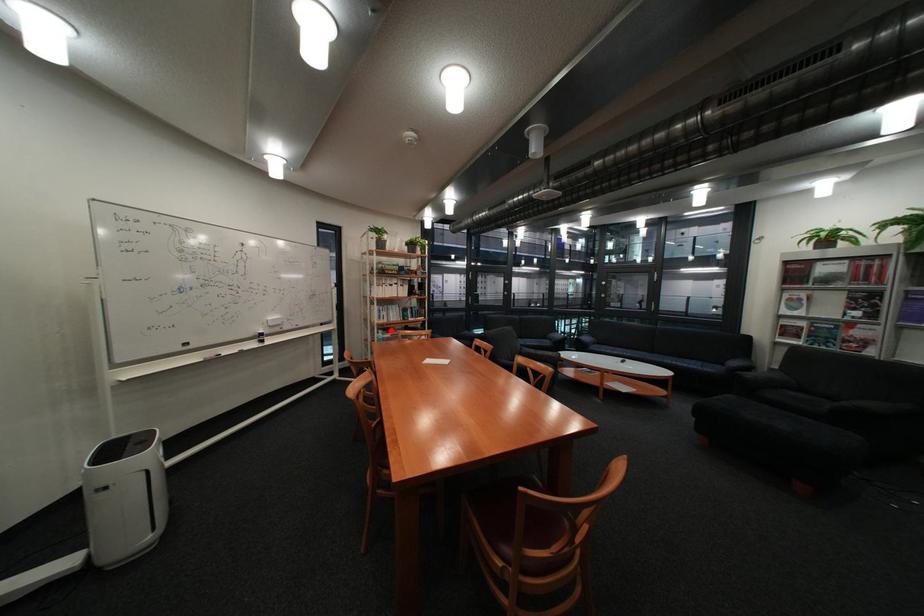
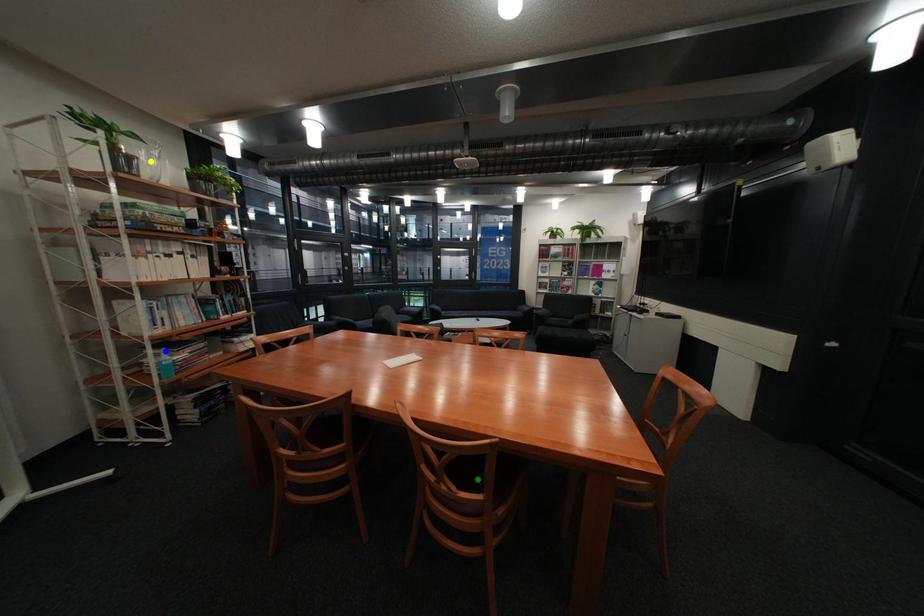
Question: I am providing you with two images of the same scene from different viewpoints. A red point is marked on the first image. You are given multiple points on the second image. Which spot in image 2 lines up with the point in image 1?

Choices:
 (A) yellow point
 (B) green point
 (C) blue point

Answer: (C)